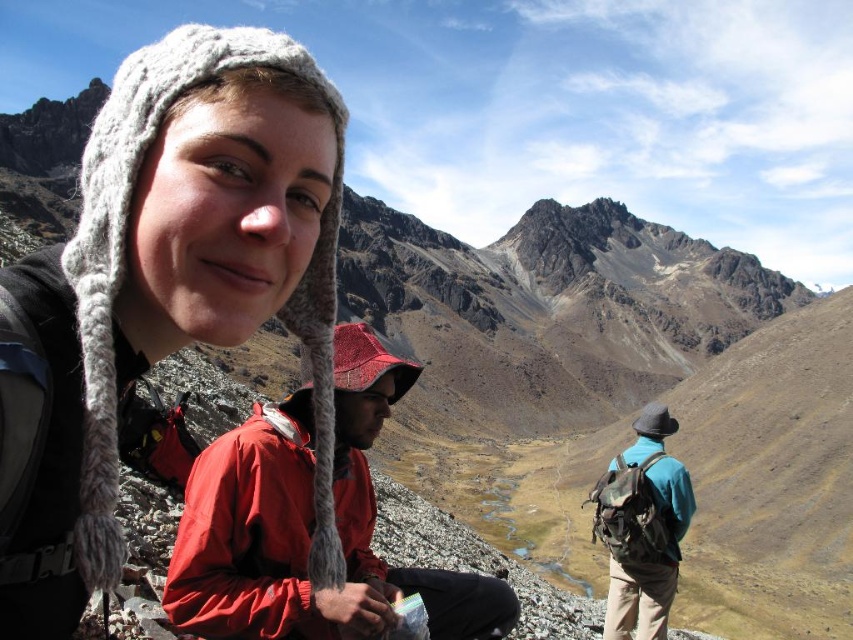
You are a photographer planning to capture a group photo of the hikers in the scene. The knitted wool hat at upper left and the teal fabric backpack at right are both important elements you want to include. Based on their positions, which object should you focus on first to ensure both are in frame?

The knitted wool hat at upper left is located above the teal fabric backpack at right, so you should focus on the knitted wool hat at upper left first to ensure both are in frame.

From the picture: You are a photographer trying to capture a group photo of the hikers. The knitted wool hat at upper left and the red waterproof jacket at center are in your frame. Since you want to ensure both are clearly visible, which object should you focus on to avoid blurriness, considering their sizes?

The knitted wool hat at upper left has a larger size compared to the red waterproof jacket at center, so focusing on the knitted wool hat at upper left would ensure both are in focus as it is larger and closer to the camera.